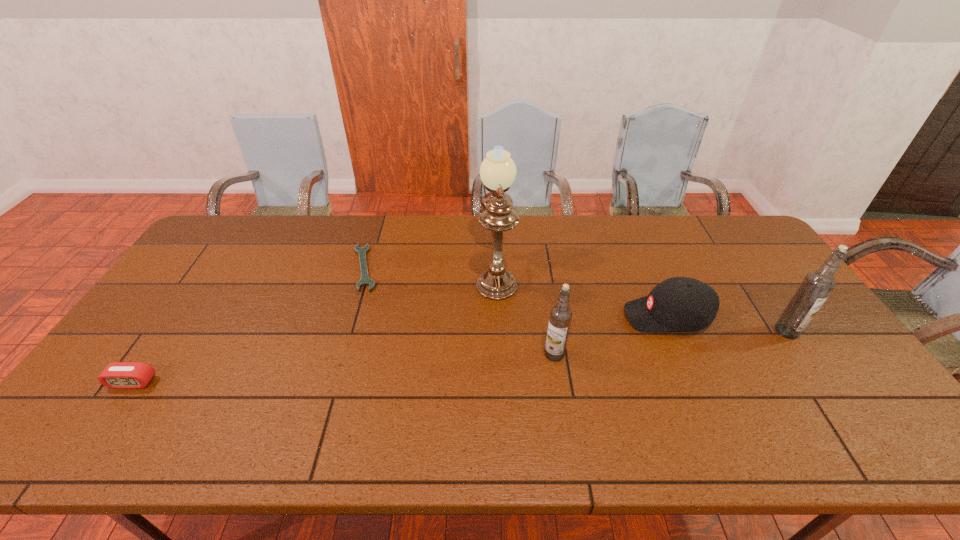
Find the location of `the nearer vodka`. the nearer vodka is located at coordinates (560, 318).

This screenshot has height=540, width=960. In order to click on the left vodka in this screenshot , I will do `click(560, 318)`.

Where is `the second tallest object`? the second tallest object is located at coordinates (816, 287).

The width and height of the screenshot is (960, 540). I want to click on the right vodka, so click(x=816, y=287).

This screenshot has height=540, width=960. Find the location of `the fifth object from left to right`. the fifth object from left to right is located at coordinates (679, 303).

What are the coordinates of `baseball cap` in the screenshot? It's located at (679, 303).

Identify the location of oil lamp. Image resolution: width=960 pixels, height=540 pixels. (497, 171).

The width and height of the screenshot is (960, 540). What are the coordinates of `the tallest object` in the screenshot? It's located at (497, 171).

Locate an element on the screen. This screenshot has width=960, height=540. the second object from left to right is located at coordinates (365, 280).

Find the location of `wrench`. wrench is located at coordinates (365, 280).